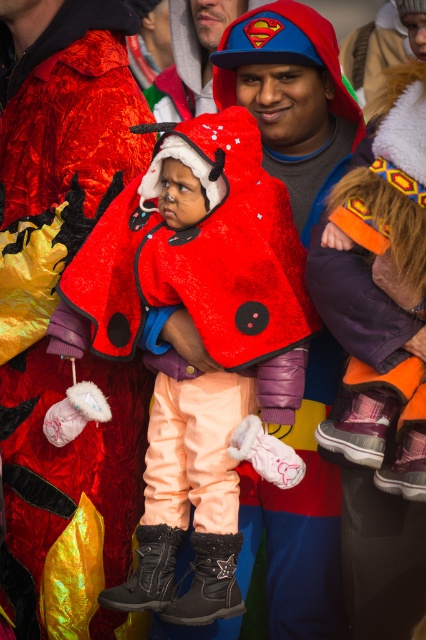
Is velvet-like red cape at center to the right of fuzzy red coat at center from the viewer's perspective?

Incorrect, velvet-like red cape at center is not on the right side of fuzzy red coat at center.

Is velvet-like red cape at center to the left of fuzzy red coat at center from the viewer's perspective?

Correct, you'll find velvet-like red cape at center to the left of fuzzy red coat at center.

The width and height of the screenshot is (426, 640). In order to click on velvet-like red cape at center in this screenshot , I will do `click(54, 307)`.

Image resolution: width=426 pixels, height=640 pixels. I want to click on velvet-like red cape at center, so tap(54, 307).

Which is behind, point (186, 442) or point (414, 196)?

The point (186, 442) is behind.

Can you confirm if fuzzy red coat at center is wider than velvet-like orange pants at lower center?

Correct, the width of fuzzy red coat at center exceeds that of velvet-like orange pants at lower center.

Describe the element at coordinates (199, 333) in the screenshot. This screenshot has height=640, width=426. I see `fuzzy red coat at center` at that location.

Where is `fuzzy red coat at center`? This screenshot has height=640, width=426. fuzzy red coat at center is located at coordinates (199, 333).

Can you confirm if velvet-like red cape at center is taller than velvet-like orange pants at lower center?

No.

Can you confirm if velvet-like red cape at center is wider than velvet-like orange pants at lower center?

In fact, velvet-like red cape at center might be narrower than velvet-like orange pants at lower center.

Does point (120, 384) lie behind point (400, 381)?

Yes, it is behind point (400, 381).

Find the location of a particular element. velvet-like red cape at center is located at coordinates (54, 307).